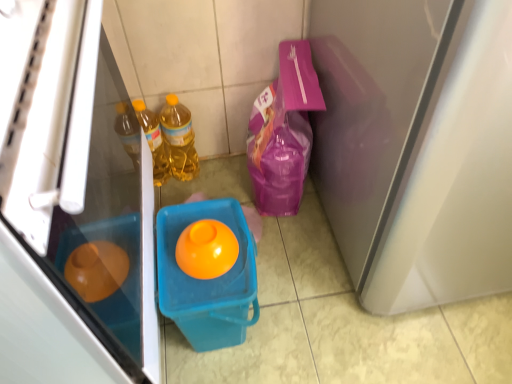
Question: From the image's perspective, would you say matte plastic refrigerator at left is shown under translucent yellow bottle at center, marked as the 2th bottle in a left-to-right arrangement?

Choices:
 (A) yes
 (B) no

Answer: (A)

Question: Does matte plastic refrigerator at left have a greater height compared to translucent yellow bottle at center, marked as the 2th bottle in a left-to-right arrangement?

Choices:
 (A) yes
 (B) no

Answer: (A)

Question: Is matte plastic refrigerator at left positioned with its back to translucent yellow bottle at center, marked as the 2th bottle in a left-to-right arrangement?

Choices:
 (A) yes
 (B) no

Answer: (B)

Question: Is matte plastic refrigerator at left next to translucent yellow bottle at center, marked as the 2th bottle in a left-to-right arrangement, and touching it?

Choices:
 (A) no
 (B) yes

Answer: (A)

Question: Is matte plastic refrigerator at left thinner than translucent yellow bottle at center, acting as the first bottle starting from the right?

Choices:
 (A) yes
 (B) no

Answer: (B)

Question: Is point (221, 274) closer or farther from the camera than point (164, 172)?

Choices:
 (A) farther
 (B) closer

Answer: (B)

Question: Which is correct: translucent plastic bucket at center is inside translucent yellow bottle at left, the first bottle when ordered from left to right, or outside of it?

Choices:
 (A) inside
 (B) outside

Answer: (B)

Question: From their relative heights in the image, would you say translucent plastic bucket at center is taller or shorter than translucent yellow bottle at left, the second bottle viewed from the right?

Choices:
 (A) tall
 (B) short

Answer: (B)

Question: From the image's perspective, is translucent plastic bucket at center located above or below translucent yellow bottle at left, the first bottle when ordered from left to right?

Choices:
 (A) below
 (B) above

Answer: (A)

Question: Considering the positions of translucent yellow bottle at center, acting as the first bottle starting from the right, and matte plastic refrigerator at left in the image, is translucent yellow bottle at center, acting as the first bottle starting from the right, taller or shorter than matte plastic refrigerator at left?

Choices:
 (A) short
 (B) tall

Answer: (A)

Question: Is translucent yellow bottle at center, marked as the 2th bottle in a left-to-right arrangement, situated inside matte plastic refrigerator at left or outside?

Choices:
 (A) inside
 (B) outside

Answer: (B)

Question: From the image's perspective, is translucent yellow bottle at center, marked as the 2th bottle in a left-to-right arrangement, positioned above or below matte plastic refrigerator at left?

Choices:
 (A) below
 (B) above

Answer: (B)

Question: From a real-world perspective, is translucent yellow bottle at center, acting as the first bottle starting from the right, above or below matte plastic refrigerator at left?

Choices:
 (A) below
 (B) above

Answer: (A)

Question: Is matte white screen door at right bigger or smaller than translucent yellow bottle at left, the first bottle when ordered from left to right?

Choices:
 (A) small
 (B) big

Answer: (B)

Question: Is point coord(345,26) positioned closer to the camera than point coord(161,137)?

Choices:
 (A) closer
 (B) farther

Answer: (A)